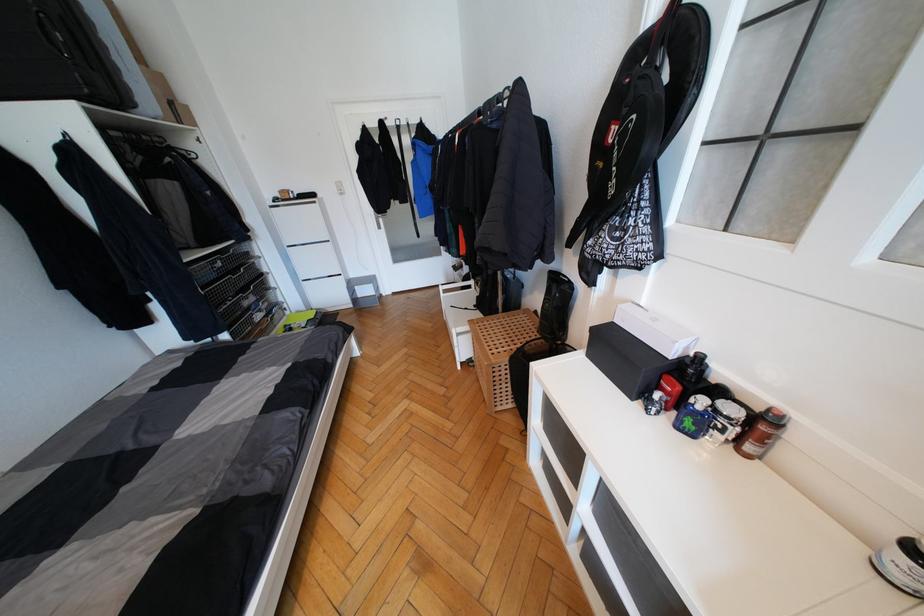
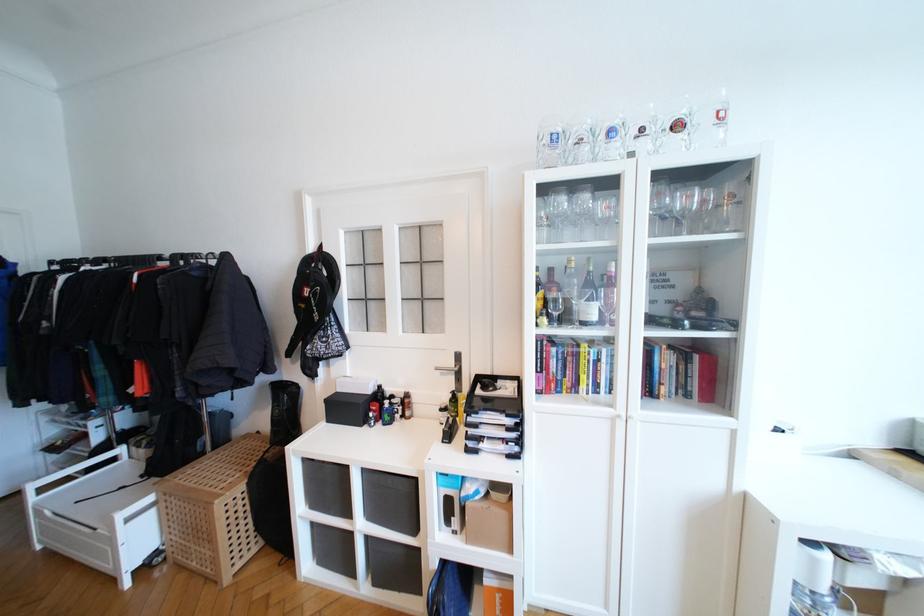
Question: How did the camera likely rotate?

Choices:
 (A) Left
 (B) Right
 (C) Up
 (D) Down

Answer: (B)